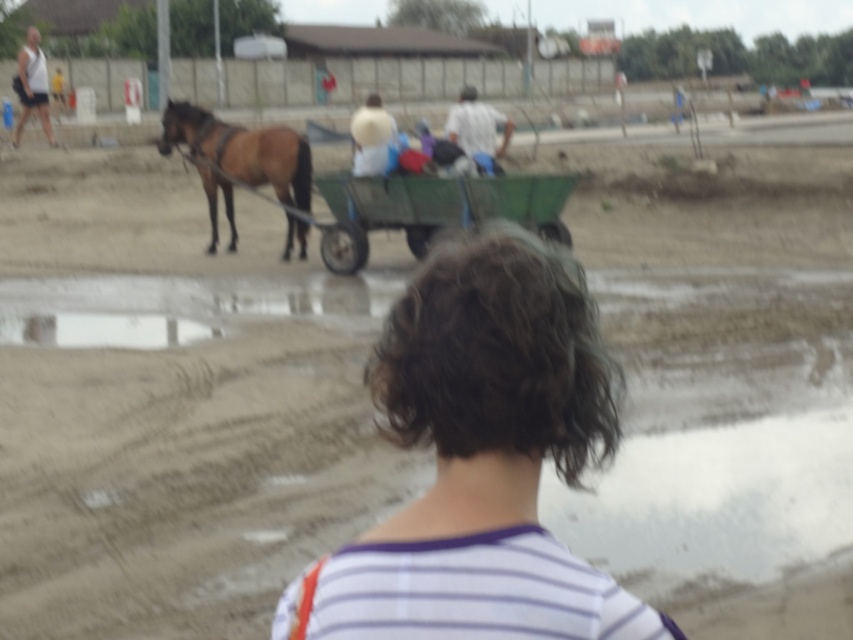
You are a photographer trying to capture the scene. You notice the brown glossy horse at upper left and the white tank top at upper left. Which object should you focus on if you want to include both in the frame without cropping either?

The brown glossy horse at upper left occupies less space than the white tank top at upper left, so you should focus on the white tank top at upper left to ensure both fit in the frame without cropping.

You are standing at the construction site and want to approach the brown glossy horse at upper left. The safety regulations state that you must stay at least 10 meters away from any working animals. Can you safely approach the horse while maintaining the required distance?

The distance between you and the brown glossy horse at upper left is 15.26 meters, which is greater than the required 10 meters. Therefore, you can safely approach the horse while maintaining the necessary distance.

You are standing at point A, which is at coordinates point (473, 134). You want to walk to point B at coordinates point (561, 268). Which direction should you move relative to your current position?

You should move forward because point (561, 268) is in front of point (473, 134).